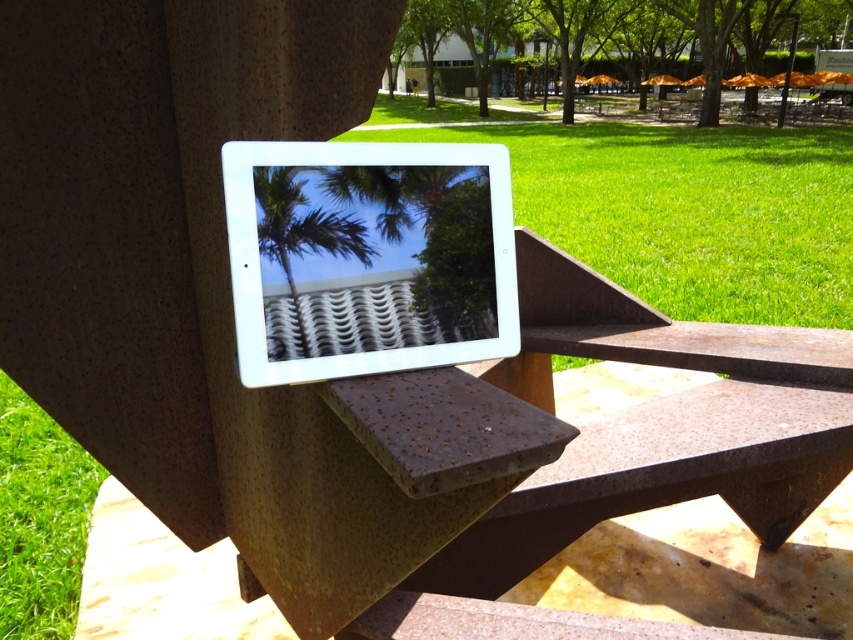
Question: Is green grass at center bigger than green grass at lower left?

Choices:
 (A) yes
 (B) no

Answer: (A)

Question: Which point appears farthest from the camera in this image?

Choices:
 (A) (376, 305)
 (B) (4, 611)
 (C) (329, 228)

Answer: (B)

Question: Is green grass at lower left below green leafy palm tree at upper center?

Choices:
 (A) yes
 (B) no

Answer: (A)

Question: Considering the real-world distances, which object is farthest from the green grass at center?

Choices:
 (A) green grass at lower left
 (B) white glossy tablet at center
 (C) green leafy tree at upper center
 (D) green leafy palm tree at upper center

Answer: (D)

Question: Which object is the farthest from the green grass at lower left?

Choices:
 (A) white glossy tablet at center
 (B) green grass at center
 (C) green leafy palm tree at upper center

Answer: (B)

Question: Does green grass at center have a lesser width compared to green leafy tree at upper center?

Choices:
 (A) yes
 (B) no

Answer: (A)